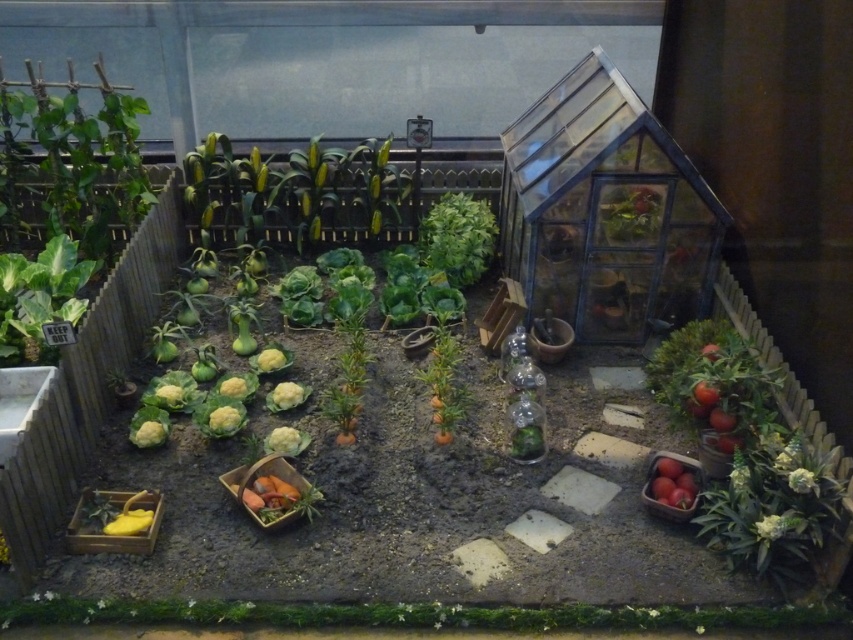
You are a gardener who wants to harvest the vegetables in the miniature garden. Which of the two vegetables, the green leafy at center or the red matte tomatoes at lower right, is larger?

The green leafy at center is bigger than the red matte tomatoes at lower right, so the green leafy at center is larger.

You are a small insect exploring the miniature garden. You are currently at the orange matte carrots at center and want to reach the green leafy at center. Which direction should you move to get there?

The green leafy at center is to the right of the orange matte carrots at center, so you should move to the right to reach it.

You are a tiny gardener standing at the center of the miniature garden enclosed by a wooden fence. You need to reach a specific point to plant a seed. Which of the two points, point (444, 268) or point (436, 428), is closer to your current position?

Neither point is closer based on their coordinates. However, according to the description, point (444, 268) is further from the camera than point (436, 428). Since you are at the center, the distance to each point depends on their positions in the garden. The description only provides depth information, not horizontal or vertical distance. Therefore, we cannot determine which is closer in terms of overall distance from your position.